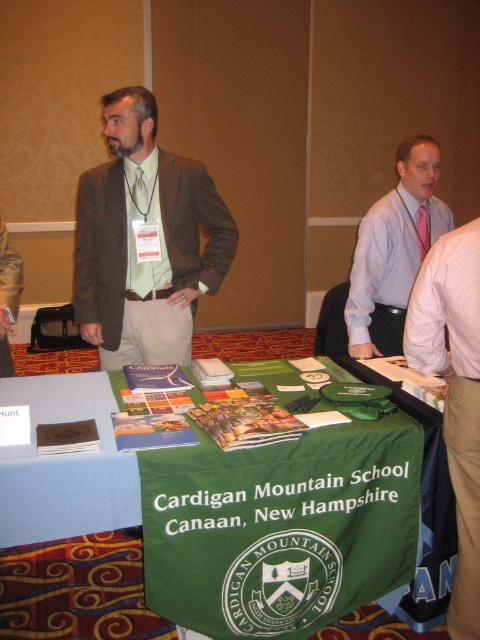
Which is in front, point (359, 621) or point (471, 552)?

Point (471, 552) is more forward.

Who is taller, green fabric table at center or pink striped shirt at right?

Standing taller between the two is pink striped shirt at right.

Is point (364, 632) in front of point (432, 332)?

No, it is behind (432, 332).

I want to click on green fabric table at center, so click(78, 589).

Can you confirm if green fabric table at center is wider than pink satin shirt at center?

Yes.

Is point (20, 637) positioned behind point (415, 170)?

That is False.

Find the location of a particular element. green fabric table at center is located at coordinates (78, 589).

The height and width of the screenshot is (640, 480). In order to click on green fabric table at center in this screenshot , I will do `click(78, 589)`.

Consider the image. Can you confirm if pink striped shirt at right is positioned above pink satin shirt at center?

No.

Which is more to the left, pink striped shirt at right or pink satin shirt at center?

pink striped shirt at right is more to the left.

Image resolution: width=480 pixels, height=640 pixels. I want to click on pink striped shirt at right, so click(x=454, y=394).